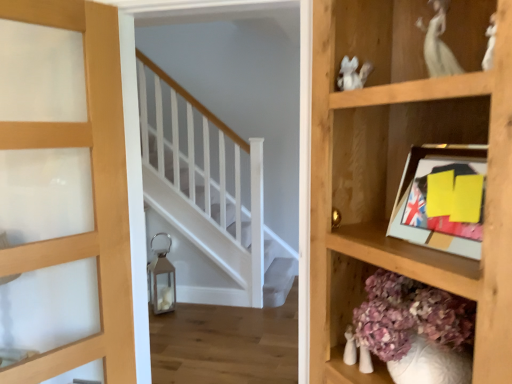
Where is `matte wood door at left`? matte wood door at left is located at coordinates (93, 193).

The height and width of the screenshot is (384, 512). Describe the element at coordinates (442, 198) in the screenshot. I see `yellow paper picture frame at upper right` at that location.

Image resolution: width=512 pixels, height=384 pixels. Identify the location of wooden shelf at right. (402, 168).

Find the location of a particular element. Image resolution: width=512 pixels, height=384 pixels. shelf positioned vertically above the matte wood door at left (from a real-world perspective) is located at coordinates (402, 168).

Is there a large distance between wooden shelf at right and matte wood door at left?

Absolutely, wooden shelf at right is distant from matte wood door at left.

Would you say wooden shelf at right contains matte wood door at left?

No, matte wood door at left is not surrounded by wooden shelf at right.

From the image's perspective, does matte wood door at left appear lower than yellow paper picture frame at upper right?

Indeed, from the image's perspective, matte wood door at left is shown beneath yellow paper picture frame at upper right.

Which of these two, matte wood door at left or yellow paper picture frame at upper right, is smaller?

With smaller size is yellow paper picture frame at upper right.

Is matte wood door at left not within yellow paper picture frame at upper right?

Yes.

Does matte wood door at left lie behind yellow paper picture frame at upper right?

Yes, the depth of matte wood door at left is greater than that of yellow paper picture frame at upper right.

From the image's perspective, relative to matte wood door at left, is yellow paper picture frame at upper right above or below?

yellow paper picture frame at upper right is above matte wood door at left.

How many degrees apart are the facing directions of yellow paper picture frame at upper right and matte wood door at left?

The angle between the facing direction of yellow paper picture frame at upper right and the facing direction of matte wood door at left is 75.5 degrees.

From a real-world perspective, which is physically above, yellow paper picture frame at upper right or matte wood door at left?

In real-world perspective, yellow paper picture frame at upper right is above.

Consider the image. In terms of height, does yellow paper picture frame at upper right look taller or shorter compared to matte wood door at left?

In the image, yellow paper picture frame at upper right appears to be shorter than matte wood door at left.

Could you tell me if matte wood door at left is facing wooden shelf at right?

No, matte wood door at left does not turn towards wooden shelf at right.

Is matte wood door at left taller or shorter than wooden shelf at right?

Considering their sizes, matte wood door at left has more height than wooden shelf at right.

Does matte wood door at left touch wooden shelf at right?

No.

Is wooden shelf at right taller than yellow paper picture frame at upper right?

Indeed, wooden shelf at right has a greater height compared to yellow paper picture frame at upper right.

Is yellow paper picture frame at upper right at the back of wooden shelf at right?

That's right, wooden shelf at right is facing away from yellow paper picture frame at upper right.

Which is in front, point (376, 186) or point (447, 241)?

The point (447, 241) is closer.

Considering the relative sizes of wooden shelf at right and yellow paper picture frame at upper right in the image provided, is wooden shelf at right wider than yellow paper picture frame at upper right?

Yes.

This screenshot has width=512, height=384. Find the location of `picture frame above the wooden shelf at right (from the image's perspective)`. picture frame above the wooden shelf at right (from the image's perspective) is located at coordinates [x=442, y=198].

Considering the positions of objects yellow paper picture frame at upper right and wooden shelf at right in the image provided, who is behind, yellow paper picture frame at upper right or wooden shelf at right?

yellow paper picture frame at upper right is more distant.

Does yellow paper picture frame at upper right have a greater height compared to wooden shelf at right?

Incorrect, the height of yellow paper picture frame at upper right is not larger of that of wooden shelf at right.

Considering the sizes of objects yellow paper picture frame at upper right and wooden shelf at right in the image provided, who is bigger, yellow paper picture frame at upper right or wooden shelf at right?

Bigger between the two is wooden shelf at right.

Image resolution: width=512 pixels, height=384 pixels. What are the coordinates of `shelf above the matte wood door at left (from the image's perspective)` in the screenshot? It's located at (402, 168).

This screenshot has height=384, width=512. I want to click on picture frame above the matte wood door at left (from a real-world perspective), so click(442, 198).

From the picture: From the image, which object appears to be farther from matte wood door at left, wooden shelf at right or yellow paper picture frame at upper right?

Based on the image, yellow paper picture frame at upper right appears to be further to matte wood door at left.

In the scene shown: Which object lies further to the anchor point matte wood door at left, yellow paper picture frame at upper right or wooden shelf at right?

Among the two, yellow paper picture frame at upper right is located further to matte wood door at left.

Consider the image. Which object lies further to the anchor point wooden shelf at right, matte wood door at left or yellow paper picture frame at upper right?

Based on the image, matte wood door at left appears to be further to wooden shelf at right.

Estimate the real-world distances between objects in this image. Which object is closer to yellow paper picture frame at upper right, matte wood door at left or wooden shelf at right?

wooden shelf at right is closer to yellow paper picture frame at upper right.

Based on their spatial positions, is yellow paper picture frame at upper right or matte wood door at left closer to wooden shelf at right?

Based on the image, yellow paper picture frame at upper right appears to be nearer to wooden shelf at right.

Consider the image. Based on their spatial positions, is wooden shelf at right or matte wood door at left closer to yellow paper picture frame at upper right?

Among the two, wooden shelf at right is located nearer to yellow paper picture frame at upper right.

Identify the location of picture frame located between matte wood door at left and wooden shelf at right in the left-right direction. The image size is (512, 384). (442, 198).